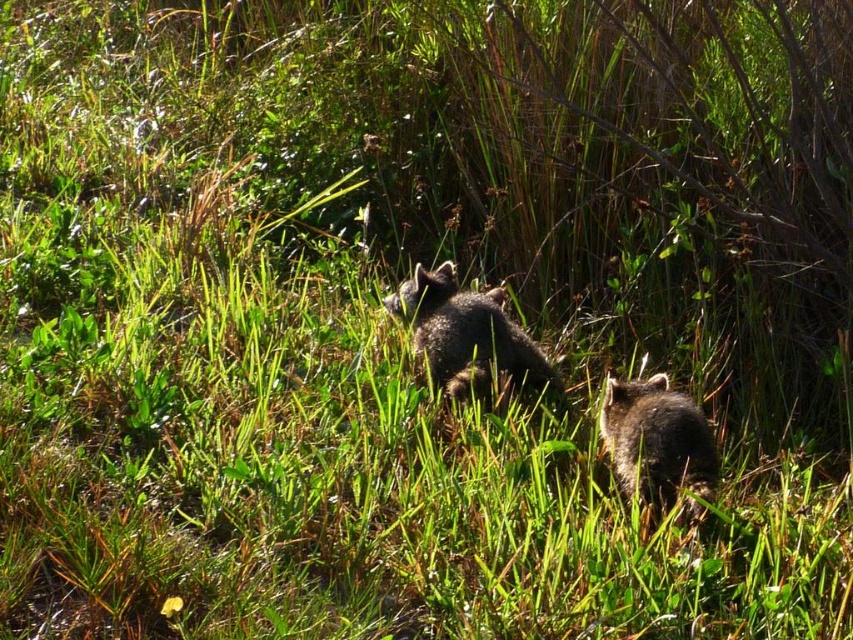
In the scene shown: Is fuzzy brown fox at center taller than fuzzy brown raccoon at lower right?

Yes.

Can you confirm if fuzzy brown fox at center is positioned above fuzzy brown raccoon at lower right?

Yes.

Does point (495, 358) come farther from viewer compared to point (674, 448)?

Yes, it is.

You are a GUI agent. You are given a task and a screenshot of the screen. Output one action in this format:
    pyautogui.click(x=<x>, y=<y>)
    Task: Click on the fuzzy brown fox at center
    The width and height of the screenshot is (853, 640).
    Given the screenshot: What is the action you would take?
    pyautogui.click(x=467, y=336)